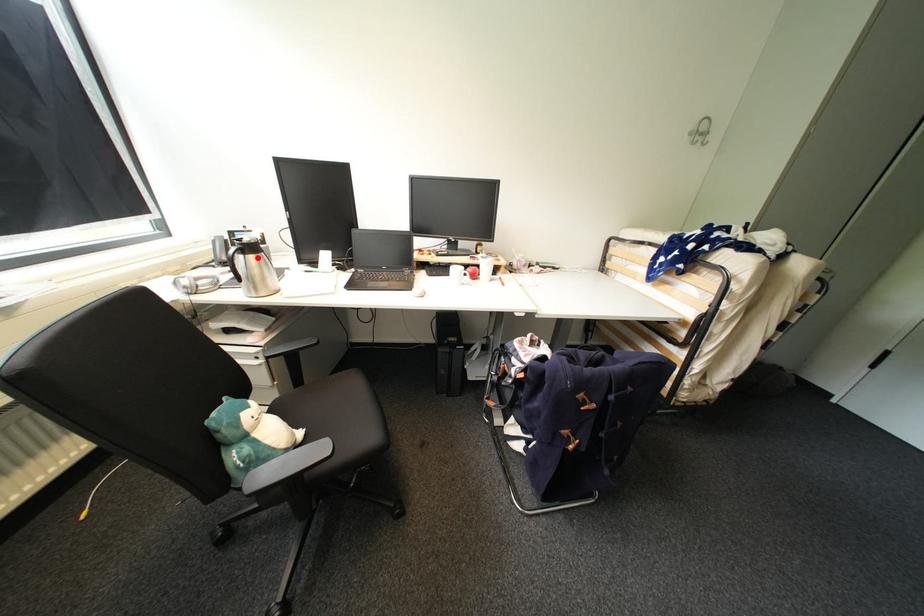
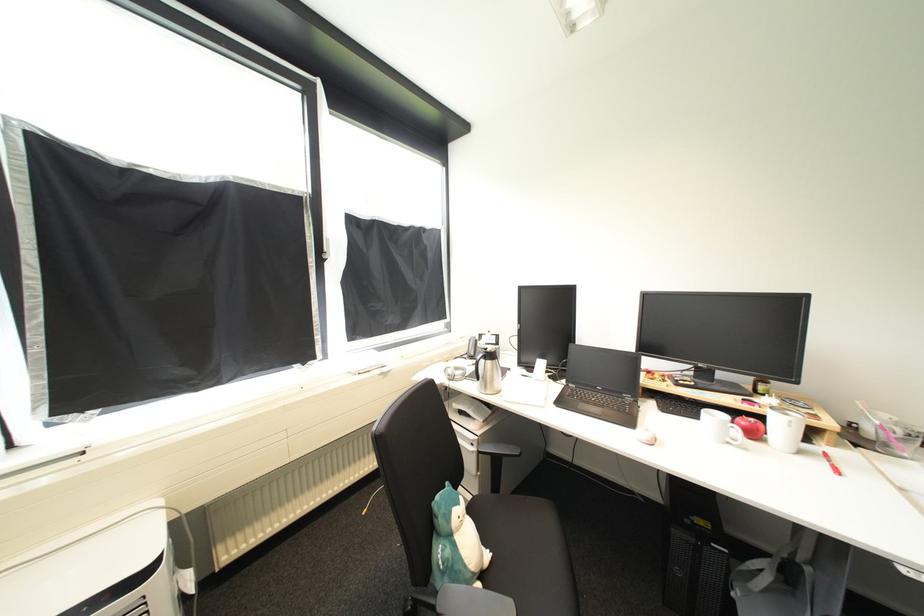
Where in the second image is the point corresponding to the highlighted location from the first image?

(495, 363)